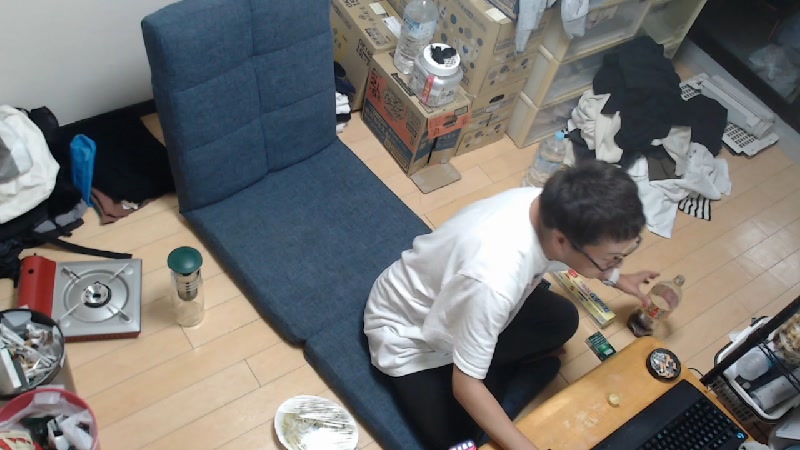
In order to click on floor in this screenshot , I will do `click(186, 377)`.